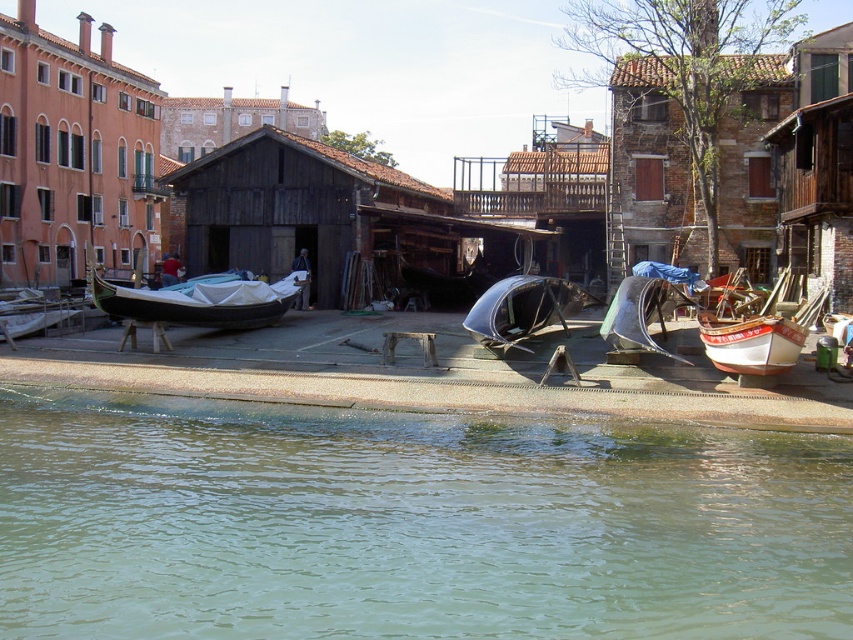
Question: Which point is farther to the camera?

Choices:
 (A) brown rustic hut at center
 (B) white wooden boat at right

Answer: (A)

Question: Is matte orange building at upper left closer to the viewer compared to wooden hut at upper right?

Choices:
 (A) yes
 (B) no

Answer: (B)

Question: Can you confirm if greenish water at lower left is thinner than brown wooden hut at upper center?

Choices:
 (A) no
 (B) yes

Answer: (B)

Question: Where is greenish water at lower left located in relation to brown wooden hut at center in the image?

Choices:
 (A) right
 (B) left

Answer: (A)

Question: Which object is closer to the camera taking this photo?

Choices:
 (A) brown rustic hut at center
 (B) greenish water at lower left

Answer: (B)

Question: Among these points, which one is farthest from the camera?

Choices:
 (A) (651, 129)
 (B) (173, 100)
 (C) (728, 369)
 (D) (517, 298)

Answer: (B)